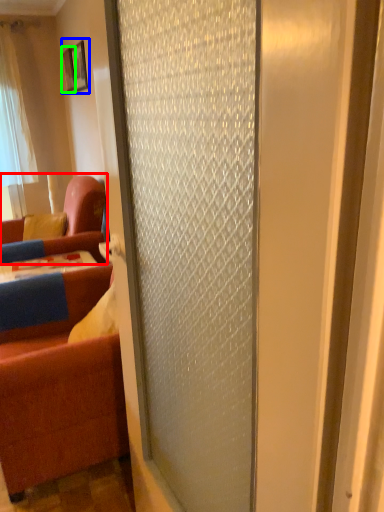
Question: Based on their relative distances, which object is nearer to studio couch (highlighted by a red box)? Choose from picture frame (highlighted by a blue box) and picture frame (highlighted by a green box).

Choices:
 (A) picture frame
 (B) picture frame

Answer: (A)